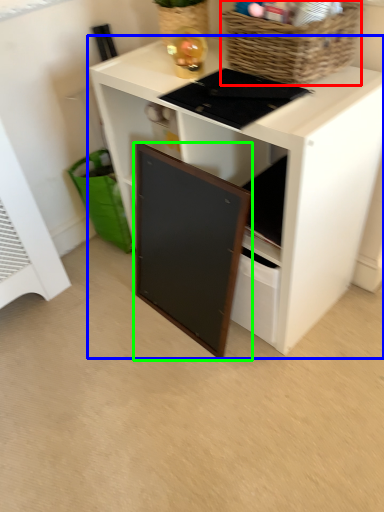
Question: Which object is the farthest from basket (highlighted by a red box)? Choose among these: desk (highlighted by a blue box) or cabinetry (highlighted by a green box).

Choices:
 (A) desk
 (B) cabinetry

Answer: (B)